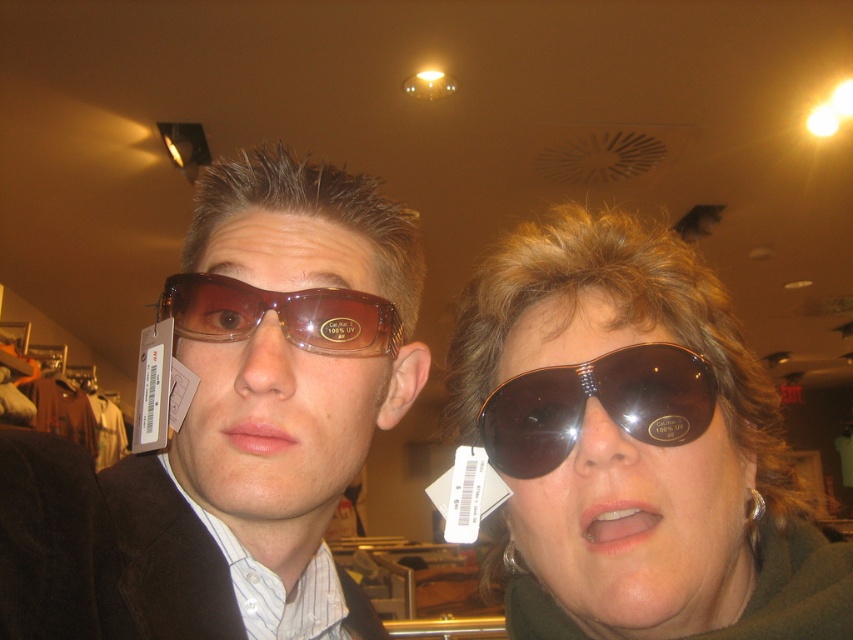
You are a customer in a store looking to buy sunglasses. You see two pairs of brown matte sunglasses at center and brown matte sunglasses at left. Which pair is wider?

The brown matte sunglasses at center is wider than the brown matte sunglasses at left.

Based on the photo, you are a customer in a store and you see two pairs of brown matte sunglasses. One is labeled as the brown matte sunglasses at center and the other as brown matte sunglasses at left. You want to pick up the pair that is lower in position. Which one should you choose?

The brown matte sunglasses at center is located below the brown matte sunglasses at left, so you should choose the brown matte sunglasses at center to pick up the lower pair.

You are a customer in a sunglasses store and want to choose between the matte brown sunglasses at left and the brown shiny aviator sunglasses at center. Which pair is bigger?

The matte brown sunglasses at left is larger in size than brown shiny aviator sunglasses at center, so the matte brown sunglasses at left is bigger.